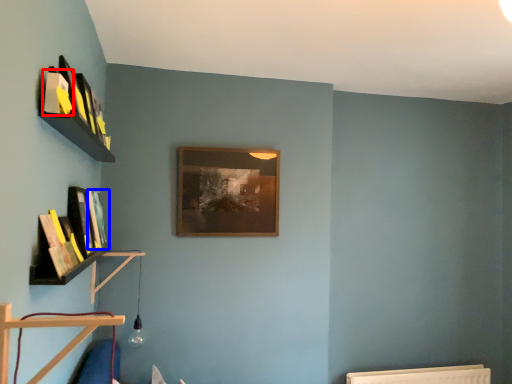
Question: Which of the following is the farthest to the observer, book (highlighted by a red box) or book (highlighted by a blue box)?

Choices:
 (A) book
 (B) book

Answer: (B)